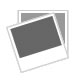
Locate an element on the screen. polaroid photos is located at coordinates (64, 10), (38, 38).